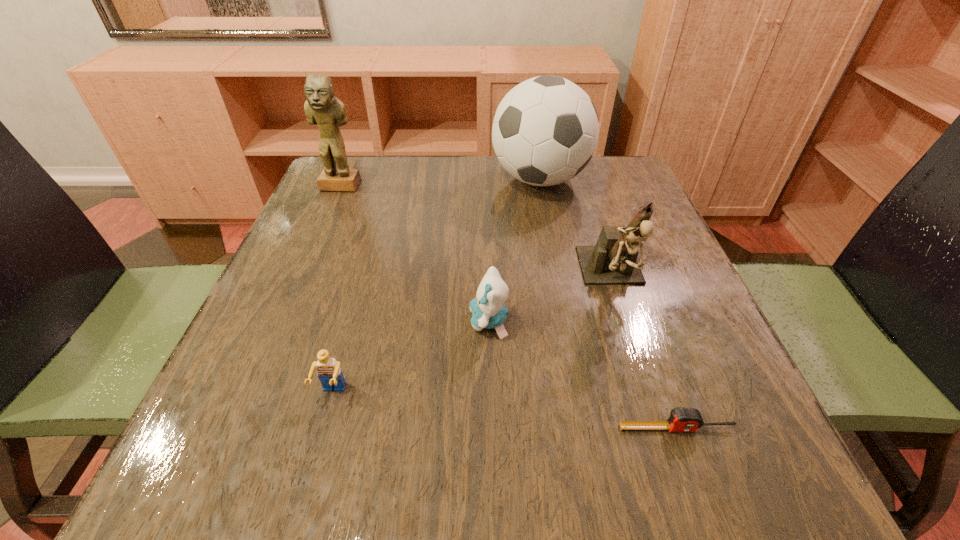
You are a GUI agent. You are given a task and a screenshot of the screen. Output one action in this format:
    pyautogui.click(x=<x>, y=<y>)
    Task: Click on the blank area in the image that satisfies the following two spatial constraints: 1. on the front side of the soccer ball; 2. on the right side of the shortest object
    
    Given the screenshot: What is the action you would take?
    pyautogui.click(x=588, y=428)